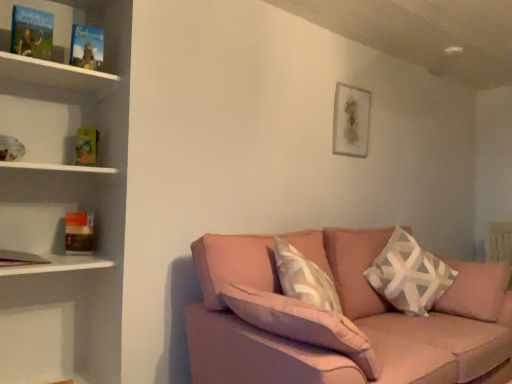
Identify the location of free space on the front side of hardcover book at upper left, the third paperback book in the bottom-to-top sequence. The image size is (512, 384). (67, 63).